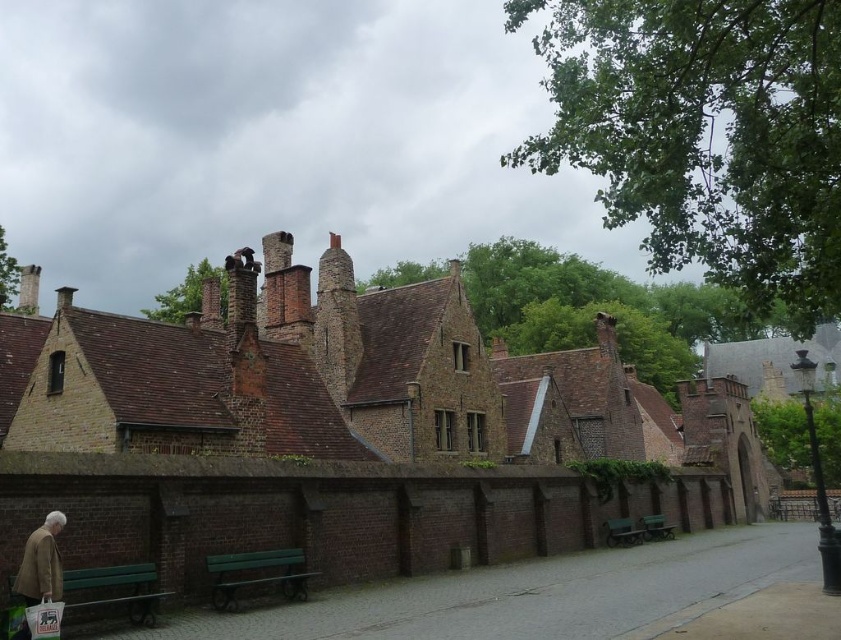
Question: Which object appears farthest from the camera in this image?

Choices:
 (A) light brown leather jacket at lower left
 (B) green wooden bench at lower center

Answer: (B)

Question: Does green painted wood bench at lower center have a larger size compared to light brown leather jacket at lower left?

Choices:
 (A) no
 (B) yes

Answer: (A)

Question: Considering the relative positions of green painted wood bench at lower center and light brown leather jacket at lower left in the image provided, where is green painted wood bench at lower center located with respect to light brown leather jacket at lower left?

Choices:
 (A) right
 (B) left

Answer: (A)

Question: Which point is closer to the camera taking this photo?

Choices:
 (A) (606, 522)
 (B) (212, 595)

Answer: (B)

Question: Is green painted wood bench at lower center to the right of light brown leather jacket at lower left from the viewer's perspective?

Choices:
 (A) no
 (B) yes

Answer: (B)

Question: Which of the following is the farthest from the observer?

Choices:
 (A) green wooden bench at center
 (B) green wooden bench at lower center
 (C) light brown leather jacket at lower left

Answer: (A)